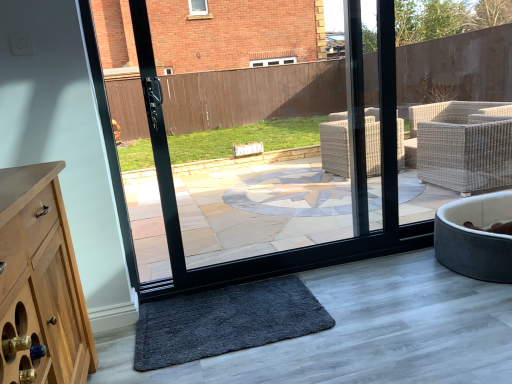
Identify the location of free space above dark gray shaggy mat at lower center (from a real-world perspective). The width and height of the screenshot is (512, 384). (206, 318).